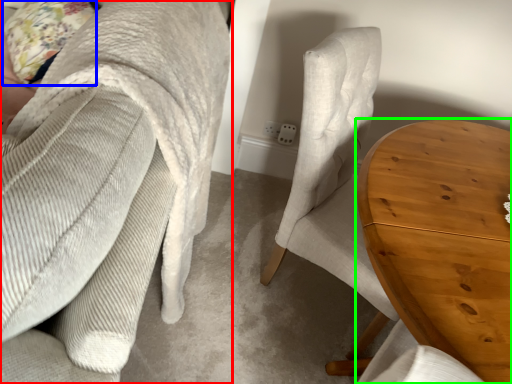
Question: Which is nearer to the chair (highlighted by a red box)? pillow (highlighted by a blue box) or table (highlighted by a green box).

Choices:
 (A) pillow
 (B) table

Answer: (B)